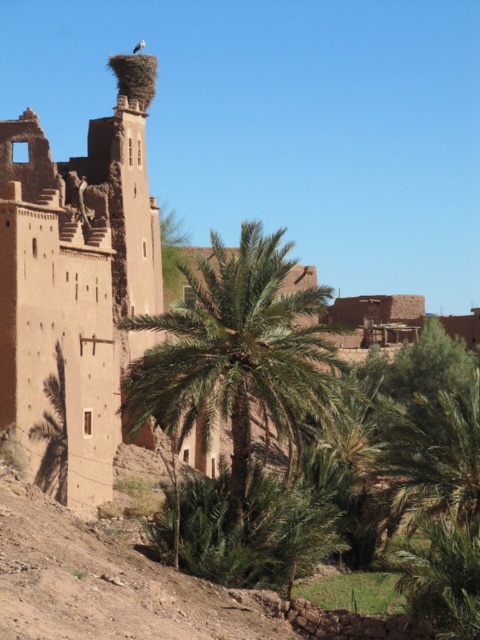
You are an ornithologist observing the desert landscape. You notice the green leafy palm at center and the brown nest at upper center. Which object is closer to you, the observer?

The green leafy palm at center is closer to you because it is in front of the brown nest at upper center.